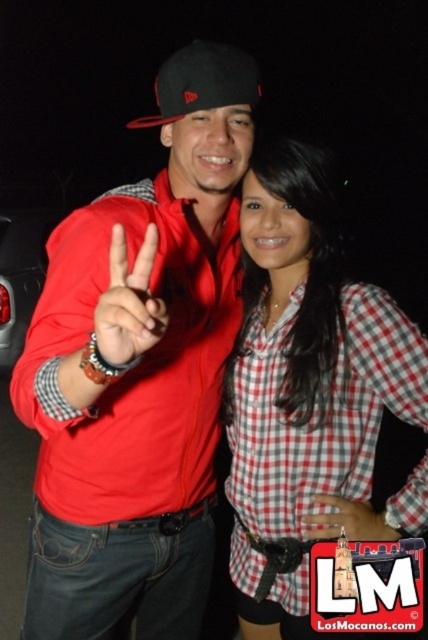
Question: Which object appears farthest from the camera in this image?

Choices:
 (A) metallic red car at left
 (B) matte red hand at center
 (C) matte black phone at center
 (D) black matte baseball cap at center

Answer: (A)

Question: Does matte red jacket at center have a lesser width compared to matte black phone at center?

Choices:
 (A) no
 (B) yes

Answer: (A)

Question: Is checkered fabric shirt at center to the right of black matte baseball cap at center from the viewer's perspective?

Choices:
 (A) no
 (B) yes

Answer: (B)

Question: Does metallic red car at left have a smaller size compared to matte black phone at center?

Choices:
 (A) yes
 (B) no

Answer: (B)

Question: Which is farther from the matte red hand at center?

Choices:
 (A) black matte baseball cap at center
 (B) matte red jacket at center
 (C) metallic red car at left

Answer: (C)

Question: Which point is closer to the camera?

Choices:
 (A) (149, 276)
 (B) (29, 234)
 (C) (32, 540)
 (D) (145, 116)

Answer: (A)